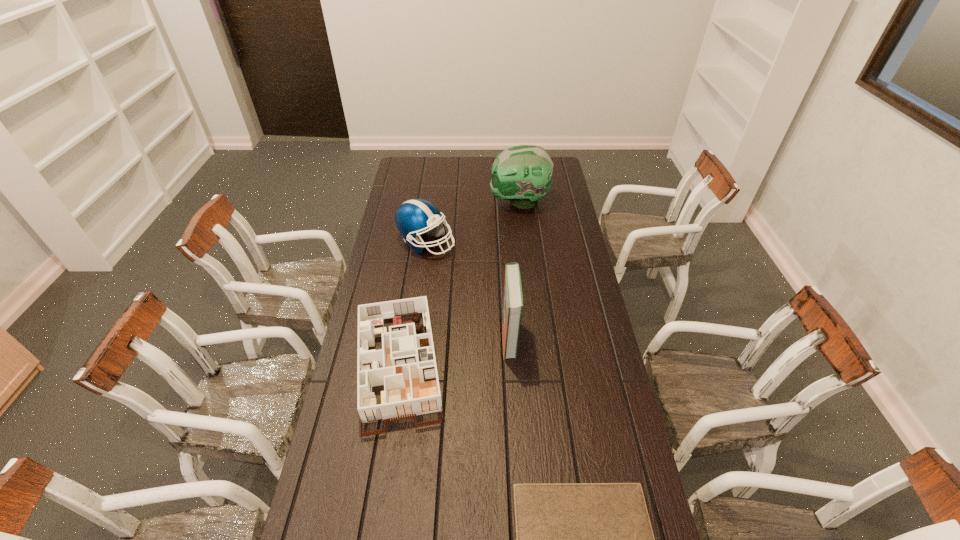
Locate an element on the screen. The width and height of the screenshot is (960, 540). the farthest object is located at coordinates (522, 174).

Where is `the farther football helmet`? The image size is (960, 540). the farther football helmet is located at coordinates (522, 174).

Find the location of `hardback book`. hardback book is located at coordinates (513, 300).

This screenshot has width=960, height=540. What are the coordinates of `the fourth nearest object` in the screenshot? It's located at (414, 217).

The width and height of the screenshot is (960, 540). In order to click on the nearer football helmet in this screenshot , I will do point(414,217).

Image resolution: width=960 pixels, height=540 pixels. I want to click on dollhouse, so click(x=405, y=364).

This screenshot has height=540, width=960. Find the location of `free spot located 0.400m on the visor of the farthest object`. free spot located 0.400m on the visor of the farthest object is located at coordinates (409, 201).

I want to click on vacant area located 0.250m on the visor of the farthest object, so tap(440, 201).

At what (x,y) coordinates should I click in order to perform the action: click on blank area located on the visor of the farthest object. Please return your answer as a coordinate pair (x, y). The image size is (960, 540). Looking at the image, I should click on (466, 201).

Identify the location of vacant space located on the cover of the hardback book. The height and width of the screenshot is (540, 960). 452,338.